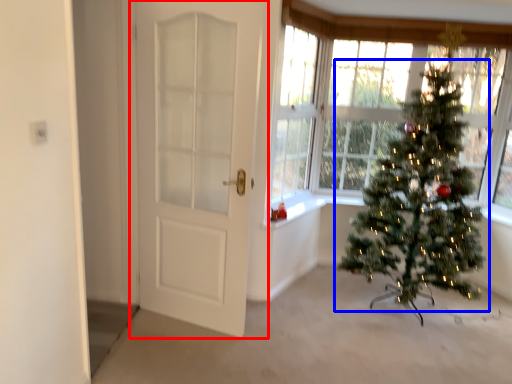
Question: Which of the following is the closest to the observer, door (highlighted by a red box) or christmas tree (highlighted by a blue box)?

Choices:
 (A) door
 (B) christmas tree

Answer: (A)